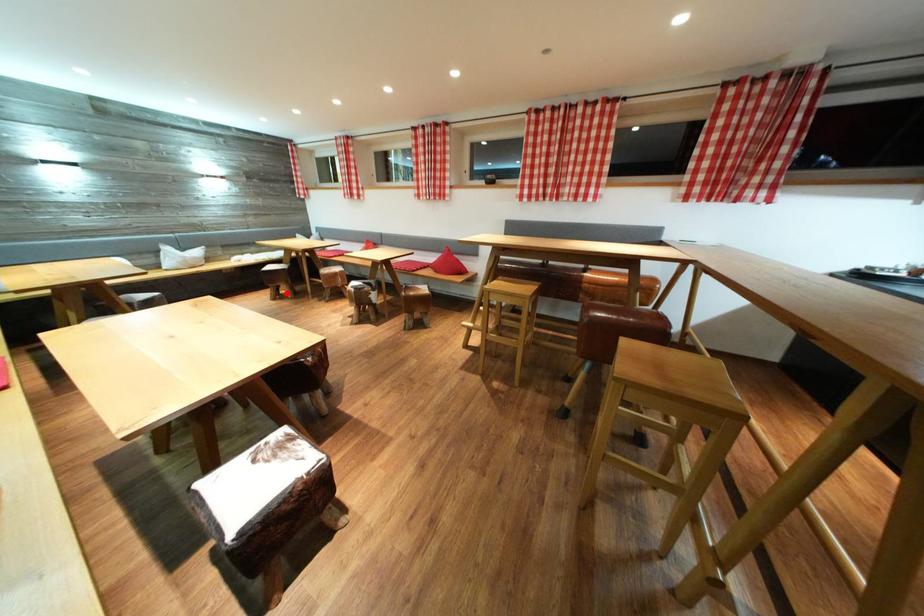
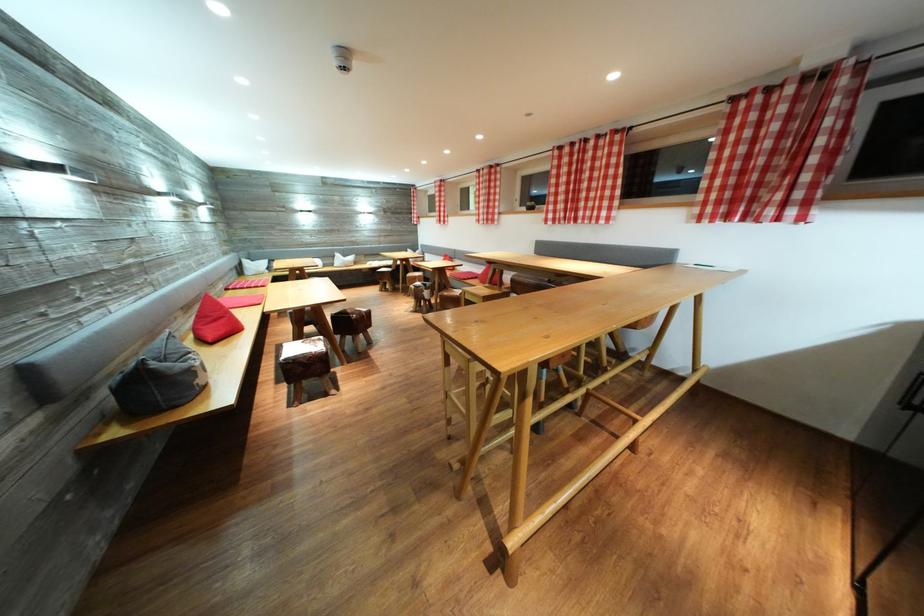
Question: I am providing you with two images of the same scene from different viewpoints. A red point is shown in image1. For the corresponding object point in image2, is it positioned nearer or farther from the camera?

Choices:
 (A) Nearer
 (B) Farther

Answer: (B)